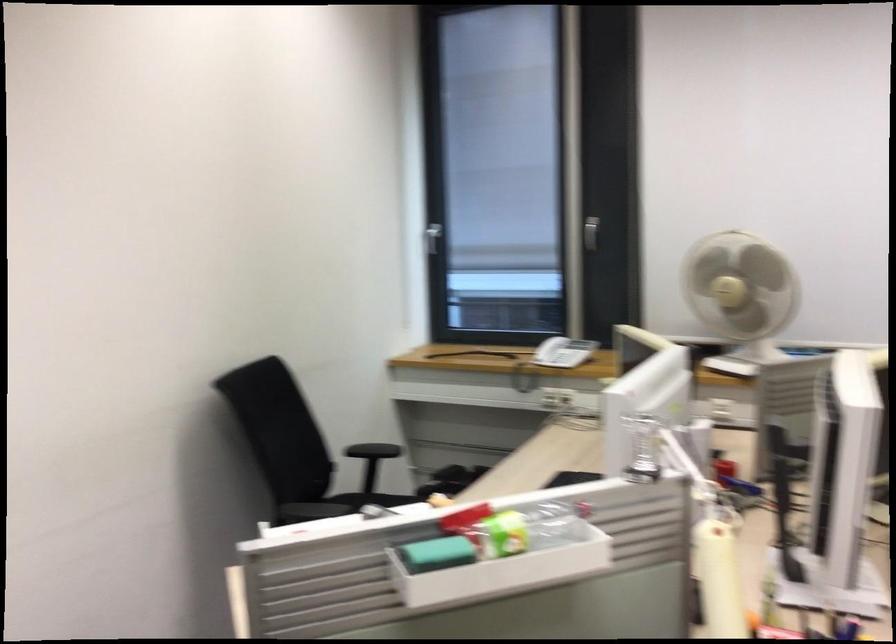
What do you see at coordinates (563, 352) in the screenshot? I see `a telephone handset` at bounding box center [563, 352].